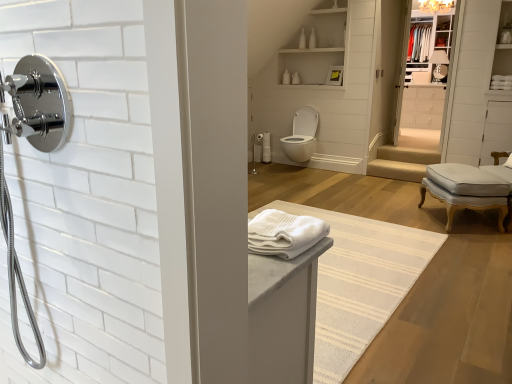
The image size is (512, 384). I want to click on vacant region to the left of light gray fabric ottoman at right, so click(397, 217).